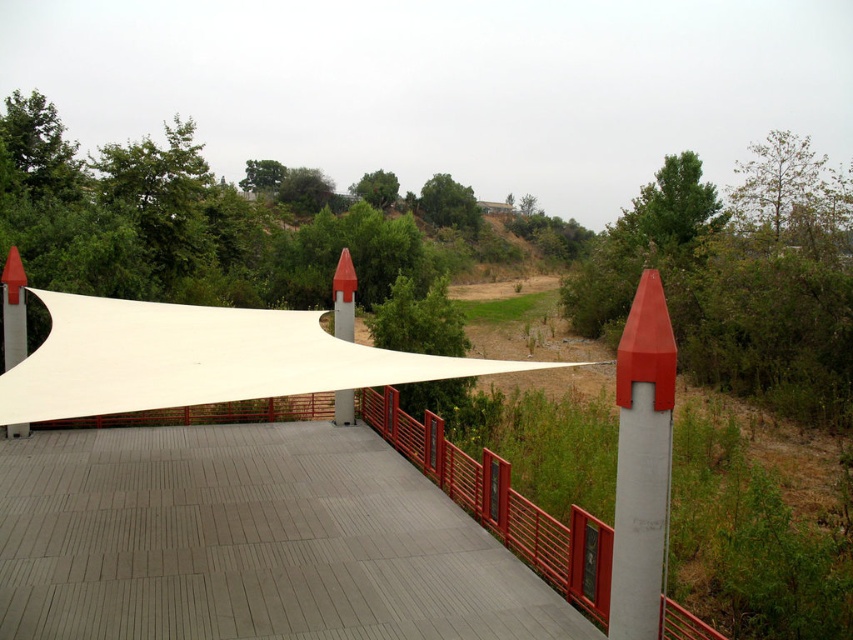
Question: Can you confirm if gray wood path at center is positioned above white fabric canopy at center?

Choices:
 (A) no
 (B) yes

Answer: (A)

Question: Is white fabric canopy at center above metallic red railing at center-right?

Choices:
 (A) no
 (B) yes

Answer: (B)

Question: Among these points, which one is farthest from the camera?

Choices:
 (A) (74, 506)
 (B) (380, 406)
 (C) (254, 362)
 (D) (637, 636)

Answer: (B)

Question: Which of these objects is positioned farthest from the matte white pole at right?

Choices:
 (A) white fabric canopy at center
 (B) gray wood path at center
 (C) metallic red railing at center-right

Answer: (A)

Question: Among these objects, which one is nearest to the camera?

Choices:
 (A) metallic red railing at center-right
 (B) matte white pole at right
 (C) white fabric canopy at center
 (D) gray wood path at center

Answer: (C)

Question: Is white fabric canopy at center positioned at the back of matte white pole at right?

Choices:
 (A) no
 (B) yes

Answer: (A)